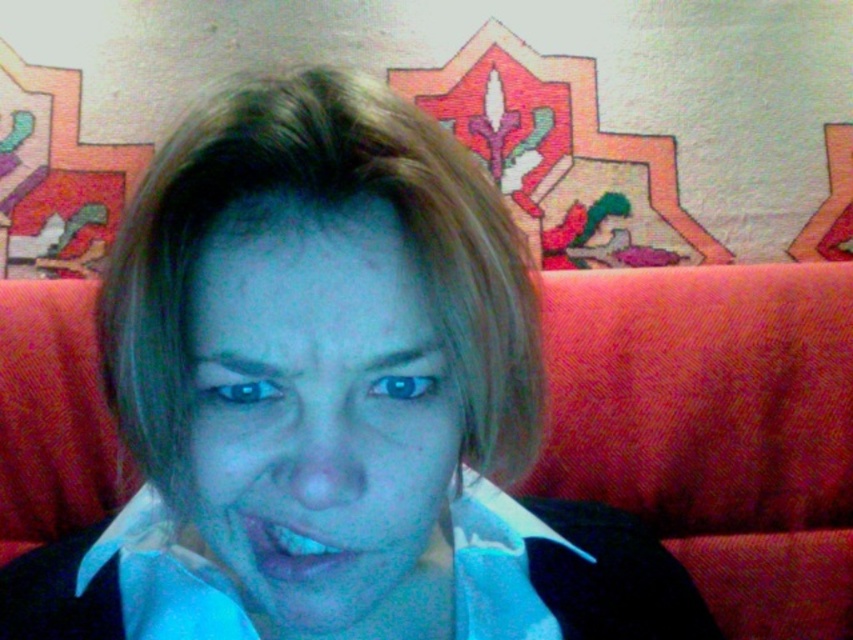
Who is positioned more to the left, blue matte face at center or blue glossy lips at center?

blue matte face at center is more to the left.

Does blue matte face at center have a smaller size compared to blue glossy lips at center?

No.

Measure the distance between point (421, 570) and camera.

Point (421, 570) and camera are 18.23 inches apart from each other.

Locate an element on the screen. The width and height of the screenshot is (853, 640). blue matte face at center is located at coordinates (322, 422).